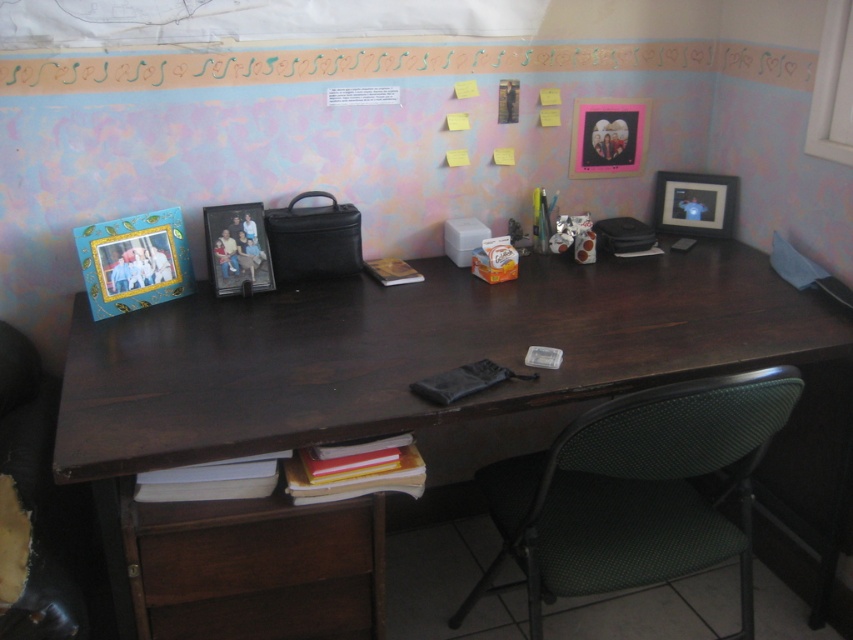
Question: Does green fabric swivel chair at lower right appear on the left side of matte black picture frame at upper right?

Choices:
 (A) no
 (B) yes

Answer: (B)

Question: Which point appears farthest from the camera in this image?

Choices:
 (A) (535, 515)
 (B) (376, 513)
 (C) (751, 340)
 (D) (621, 132)

Answer: (D)

Question: Does dark wood computer desk at center appear under green fabric swivel chair at lower right?

Choices:
 (A) yes
 (B) no

Answer: (B)

Question: Which of the following is the closest to the observer?

Choices:
 (A) matte black picture frame at upper right
 (B) dark wood drawer at lower left
 (C) pink matte picture frame at upper right

Answer: (B)

Question: Which of the following is the farthest from the observer?

Choices:
 (A) matte plastic picture frame at center
 (B) pink matte picture frame at upper right
 (C) dark wood computer desk at center

Answer: (B)

Question: Does dark wood computer desk at center appear over pink matte picture frame at upper right?

Choices:
 (A) yes
 (B) no

Answer: (B)